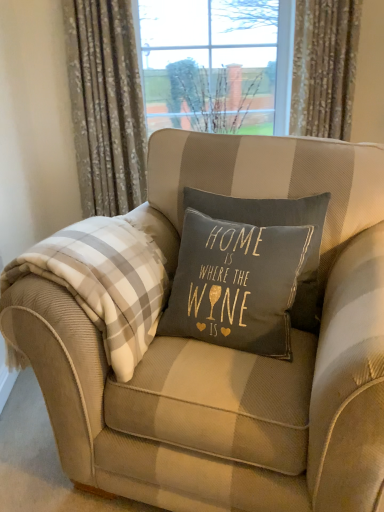
Question: From the image's perspective, relative to floral fabric curtain at upper left, the 1th curtain positioned from the left, is white plaid blanket at left above or below?

Choices:
 (A) above
 (B) below

Answer: (B)

Question: In terms of size, does white plaid blanket at left appear bigger or smaller than floral fabric curtain at upper left, marked as the 2th curtain in a right-to-left arrangement?

Choices:
 (A) small
 (B) big

Answer: (A)

Question: Based on their relative distances, which object is nearer to the white plaid blanket at left?

Choices:
 (A) beige striped armchair at center
 (B) floral fabric curtain at upper left, marked as the 2th curtain in a right-to-left arrangement
 (C) floral fabric curtain at upper right, which ranks as the first curtain in right-to-left order

Answer: (A)

Question: Based on their relative distances, which object is nearer to the floral fabric curtain at upper right, which is the 2th curtain from left to right?

Choices:
 (A) white plaid blanket at left
 (B) floral fabric curtain at upper left, the 1th curtain positioned from the left
 (C) beige striped armchair at center

Answer: (B)